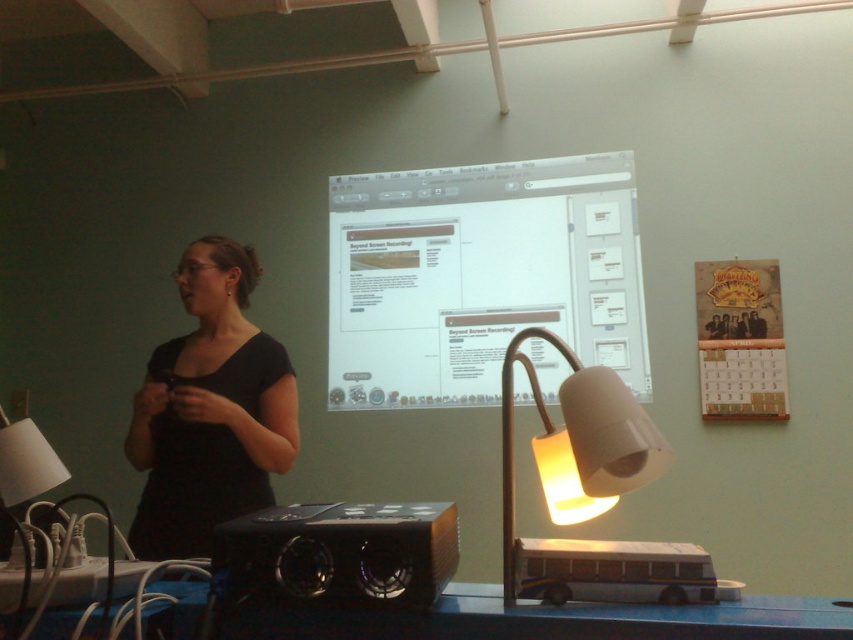
You are sitting in the front row of the presentation and want to hand a note to the presenter. Which object, the black matte shirt at left or the black plastic speaker at lower center, is closer to you?

The black matte shirt at left is closer to you because it is further to the viewer than the black plastic speaker at lower center, meaning it is nearer in the presentation setting.

You are attending a presentation and want to take a photo of the point at coordinates (450, 604). The camera you have can only focus on objects within 3 feet. Can you take a clear photo of the point?

The point at coordinates (450, 604) is 3.38 feet away from the viewer, which is beyond the camera focus range of 3 feet. Therefore, you cannot take a clear photo of the point.

You are attending a presentation and need to locate the speaker. The presenter is wearing the black matte shirt at left. Where is the black plastic speaker at lower center in relation to the presenter?

The black plastic speaker at lower center is to the right of the black matte shirt at left.